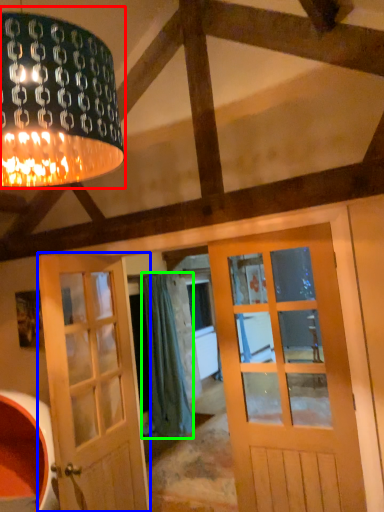
Question: Which object is positioned farthest from lamp (highlighted by a red box)? Select from door (highlighted by a blue box) and curtain (highlighted by a green box).

Choices:
 (A) door
 (B) curtain

Answer: (B)